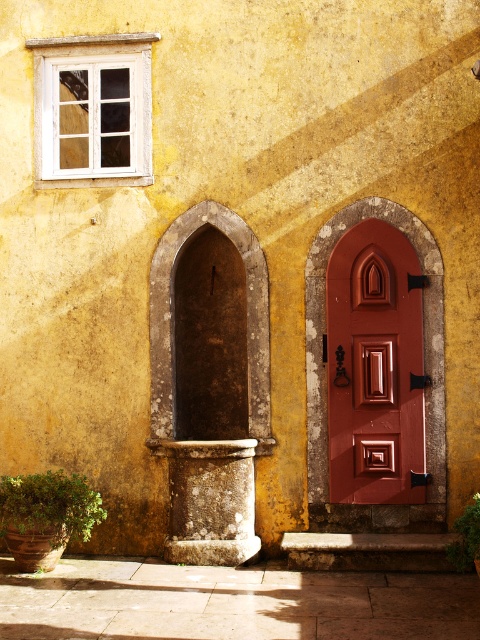
You are standing in front of the building and want to locate the point at coordinates (x=93, y=109). Based on the scene description, where would this point be located relative to the white wooden window at upper left?

The point at coordinates (x=93, y=109) is located on the white wooden window at upper left.

You are standing in front of the building and want to locate both the white wooden window at upper left and the brown stone archway at center. Which object is positioned to the left of the other?

The white wooden window at upper left is to the left of the brown stone archway at center.